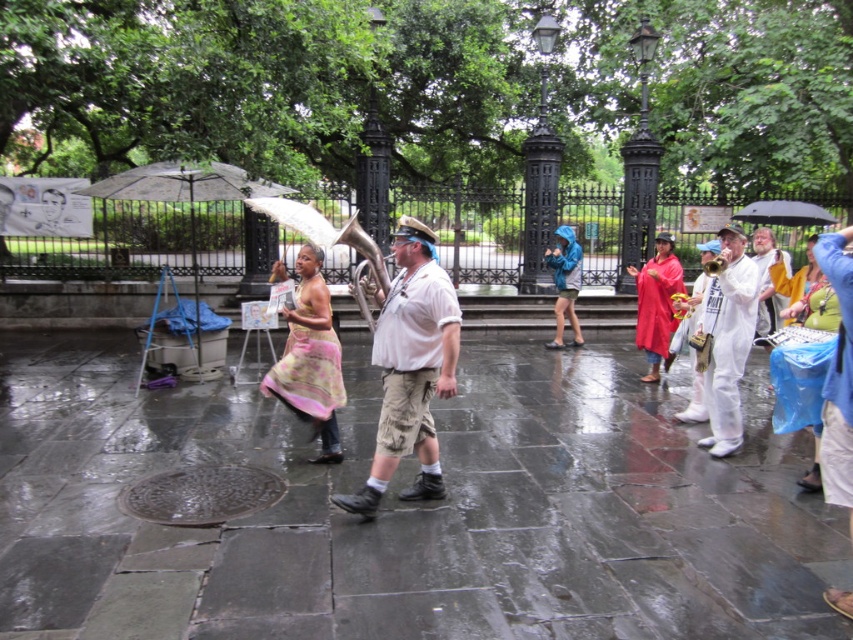
You are a pedestrian holding a blue fabric umbrella at upper right and see a blue plastic bag at right. Which object is higher up in the image?

The blue plastic bag at right is above the blue fabric umbrella at upper right, so the blue plastic bag at right is higher up in the image.

You are standing at the center of the park and want to avoid getting your shoes wet. The dark gray stone pavement at center is represented by point (409, 509). Where should you step to stay dry?

Step on the dark gray stone pavement at center represented by point (409, 509) to stay dry since it is the dry area marked in the scene.